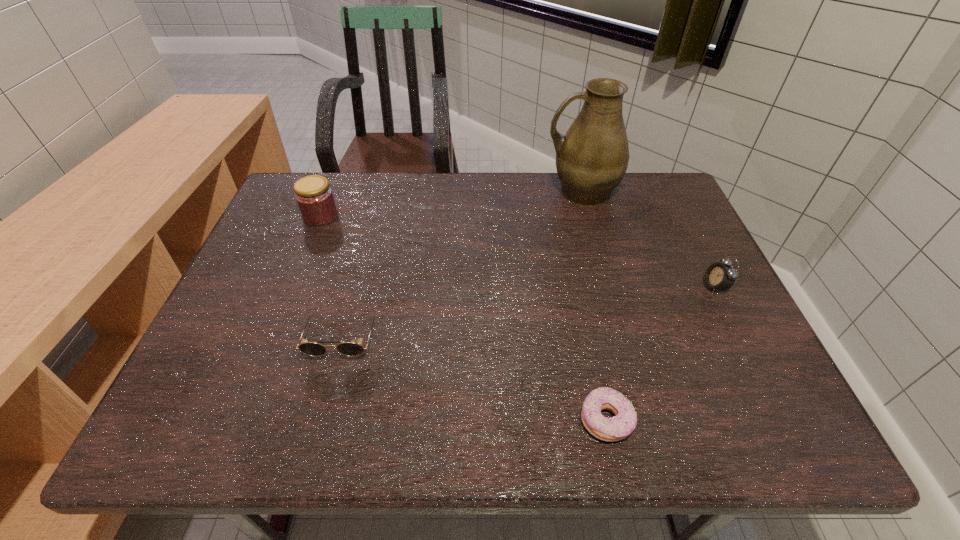
You are a GUI agent. You are given a task and a screenshot of the screen. Output one action in this format:
    pyautogui.click(x=<x>, y=<y>)
    Task: Click on the object present at the near edge
    This screenshot has height=540, width=960.
    Given the screenshot: What is the action you would take?
    pyautogui.click(x=616, y=428)

Locate an element on the screen. object located at the left edge is located at coordinates [x=315, y=199].

Image resolution: width=960 pixels, height=540 pixels. Identify the location of object present at the right edge. (719, 276).

Where is `object at the far left corner`? The height and width of the screenshot is (540, 960). object at the far left corner is located at coordinates (315, 199).

This screenshot has width=960, height=540. In the image, there is a desktop. Identify the location of free region at the far edge. (491, 215).

Identify the location of vacant region at the near edge of the desktop. (572, 430).

The width and height of the screenshot is (960, 540). In order to click on vacant region at the left edge of the desktop in this screenshot , I will do `click(234, 305)`.

Image resolution: width=960 pixels, height=540 pixels. I want to click on free location at the right edge, so click(x=674, y=228).

Locate an element on the screen. free space at the far left corner of the desktop is located at coordinates (287, 201).

Image resolution: width=960 pixels, height=540 pixels. In the image, there is a desktop. Find the location of `blank space at the near right corner`. blank space at the near right corner is located at coordinates (708, 423).